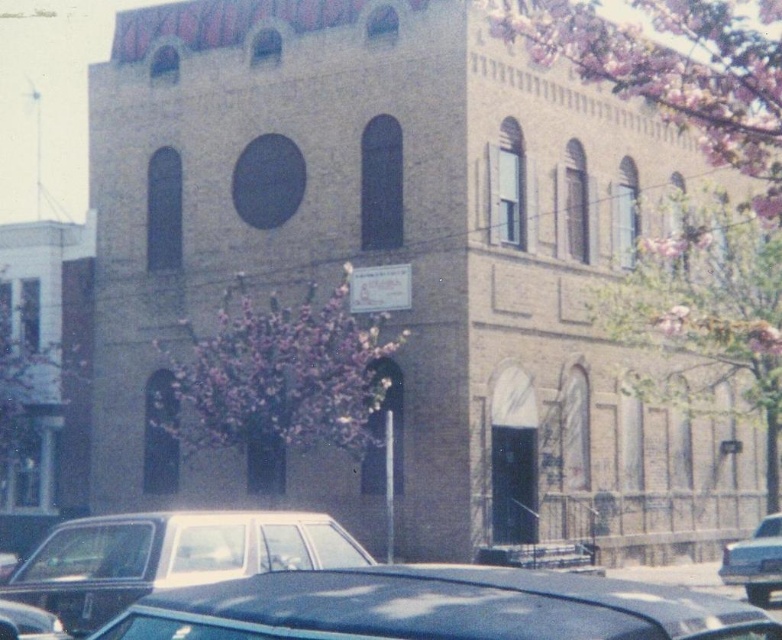
Question: Is pink blossoms at left smaller than shiny black car at lower left?

Choices:
 (A) yes
 (B) no

Answer: (B)

Question: Which of the following is the farthest from the observer?

Choices:
 (A) (768, 520)
 (B) (318, 388)

Answer: (A)

Question: Among these points, which one is nearest to the camera?

Choices:
 (A) (167, 362)
 (B) (759, 518)

Answer: (A)

Question: From the image, what is the correct spatial relationship of pink blossoms at upper center in relation to shiny silver sedan at lower right?

Choices:
 (A) above
 (B) below

Answer: (A)

Question: Which object is closer to the camera taking this photo?

Choices:
 (A) shiny blue sedan at lower center
 (B) pink blossoms at center

Answer: (A)

Question: Is shiny black car at lower center to the right of shiny blue sedan at lower center from the viewer's perspective?

Choices:
 (A) no
 (B) yes

Answer: (B)